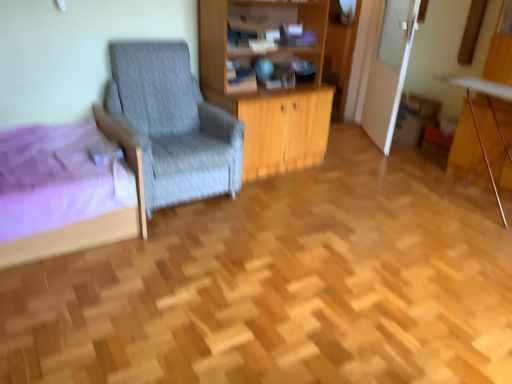
Identify the location of free space in front of gray fabric chair at left. (185, 243).